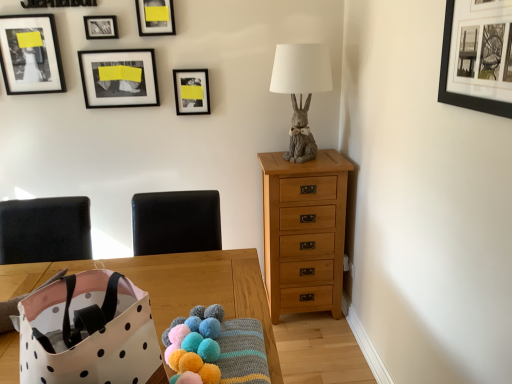
Question: Is matte gray rabbit at upper right surrounded by fluffy yarn balls at lower center?

Choices:
 (A) yes
 (B) no

Answer: (B)

Question: Is the position of fluffy yarn balls at lower center less distant than that of matte gray rabbit at upper right?

Choices:
 (A) yes
 (B) no

Answer: (A)

Question: From the image's perspective, is fluffy yarn balls at lower center on matte gray rabbit at upper right?

Choices:
 (A) yes
 (B) no

Answer: (B)

Question: Is fluffy yarn balls at lower center behind matte gray rabbit at upper right?

Choices:
 (A) no
 (B) yes

Answer: (A)

Question: Is fluffy yarn balls at lower center taller than matte gray rabbit at upper right?

Choices:
 (A) yes
 (B) no

Answer: (B)

Question: Would you say light brown wood chest of drawers at right is inside or outside black leather armchair at center?

Choices:
 (A) inside
 (B) outside

Answer: (B)

Question: From a real-world perspective, is light brown wood chest of drawers at right positioned above or below black leather armchair at center?

Choices:
 (A) above
 (B) below

Answer: (B)

Question: In the image, is light brown wood chest of drawers at right positioned in front of or behind black leather armchair at center?

Choices:
 (A) behind
 (B) front

Answer: (A)

Question: In terms of height, does light brown wood chest of drawers at right look taller or shorter compared to black leather armchair at center?

Choices:
 (A) short
 (B) tall

Answer: (B)

Question: Is matte gray rabbit at upper right taller or shorter than matte black picture frame at upper center, which is the third picture frame from front to back?

Choices:
 (A) tall
 (B) short

Answer: (A)

Question: From a real-world perspective, is matte gray rabbit at upper right physically located above or below matte black picture frame at upper center, the 4th picture frame from the back?

Choices:
 (A) below
 (B) above

Answer: (A)

Question: Considering the positions of matte gray rabbit at upper right and matte black picture frame at upper center, the 3th picture frame from the right, in the image, is matte gray rabbit at upper right bigger or smaller than matte black picture frame at upper center, the 3th picture frame from the right,?

Choices:
 (A) big
 (B) small

Answer: (A)

Question: From the image's perspective, is matte gray rabbit at upper right located above or below matte black picture frame at upper center, the 4th picture frame from the back?

Choices:
 (A) above
 (B) below

Answer: (B)

Question: From a real-world perspective, relative to white polka dot fabric bag at lower left, is black leather armchair at center vertically above or below?

Choices:
 (A) above
 (B) below

Answer: (B)

Question: In terms of width, does black leather armchair at center look wider or thinner when compared to white polka dot fabric bag at lower left?

Choices:
 (A) wide
 (B) thin

Answer: (B)